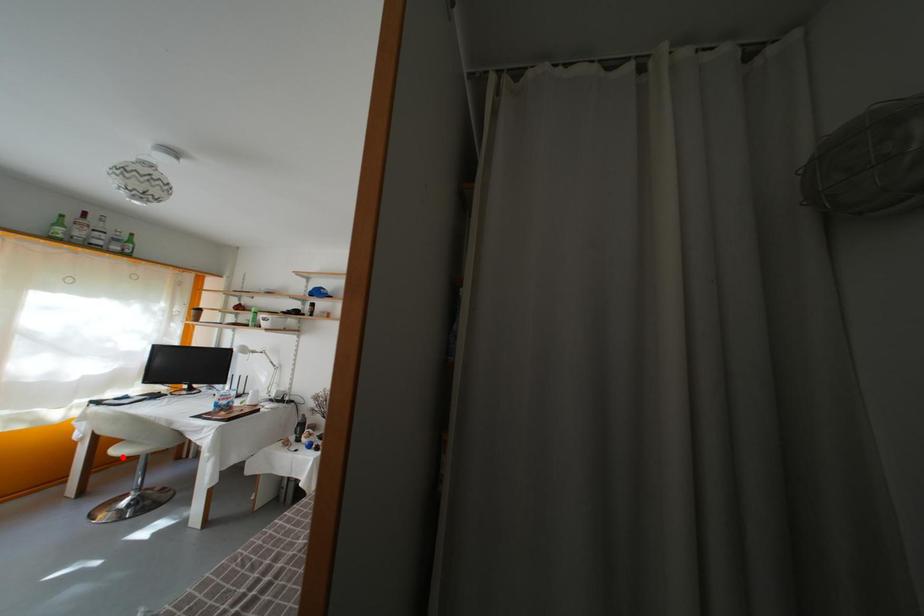
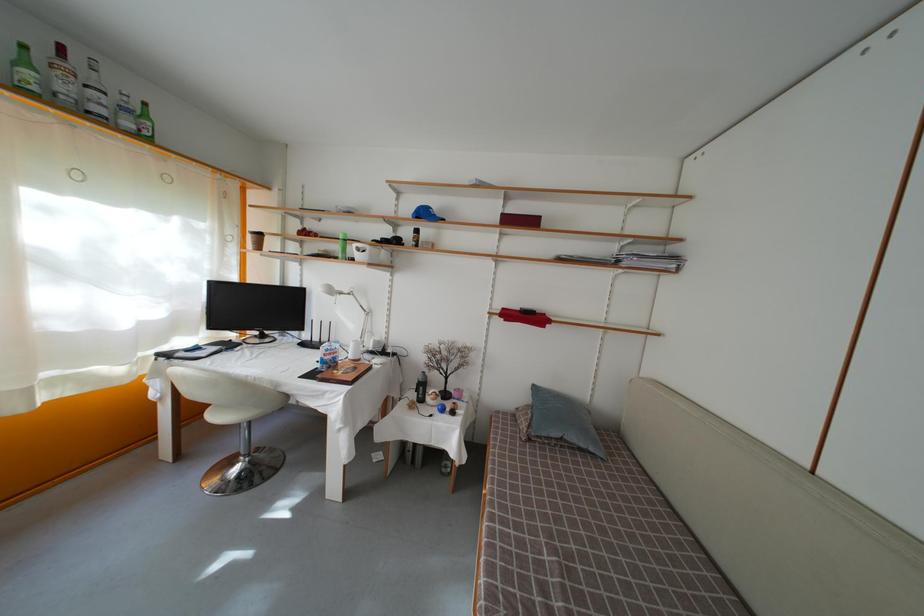
Question: I am providing you with two images of the same scene from different viewpoints. Given a red point in image1, look at the same physical point in image2. Is it:

Choices:
 (A) Closer to the viewpoint
 (B) Farther from the viewpoint

Answer: (B)